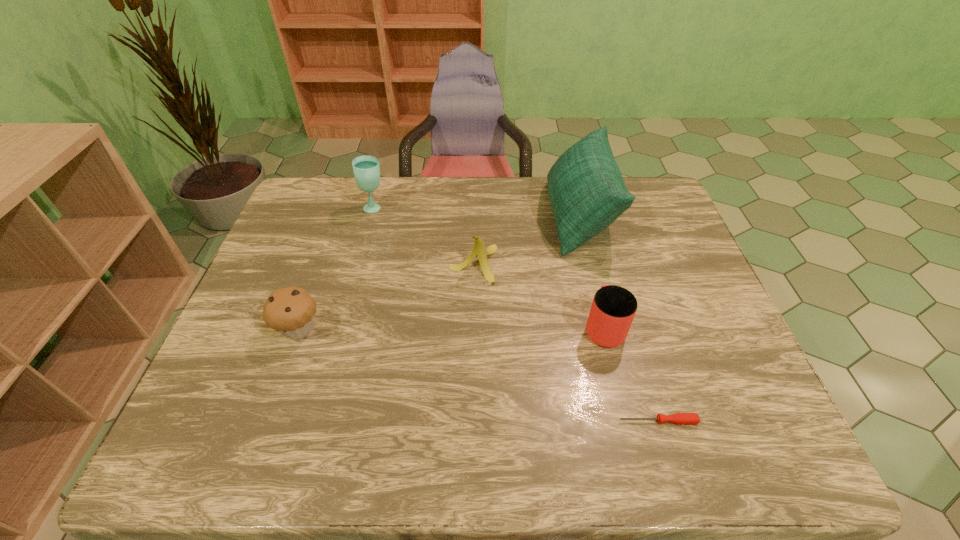
Select which object appears as the fifth closest to the muffin. Please provide its 2D coordinates. Your answer should be formatted as a tuple, i.e. [(x, y)], where the tuple contains the x and y coordinates of a point satisfying the conditions above.

[(679, 418)]

At what (x,y) coordinates should I click in order to perform the action: click on free location that satisfies the following two spatial constraints: 1. on the back side of the leftmost object; 2. on the left side of the glass. Please return your answer as a coordinate pair (x, y). Looking at the image, I should click on (343, 207).

This screenshot has height=540, width=960. Find the location of `vacant position in the image that satisfies the following two spatial constraints: 1. on the front-facing side of the tallest object; 2. on the front side of the fourth object from right to left`. vacant position in the image that satisfies the following two spatial constraints: 1. on the front-facing side of the tallest object; 2. on the front side of the fourth object from right to left is located at coordinates (591, 264).